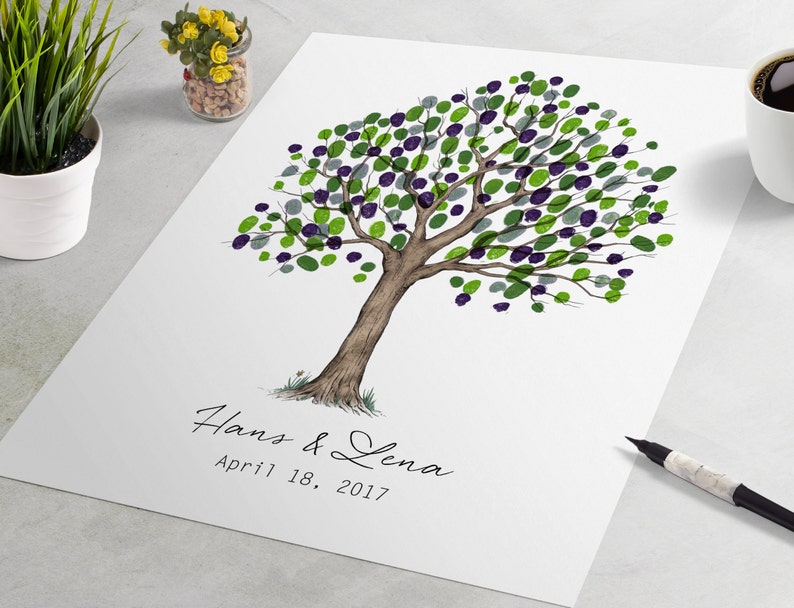
I want to click on plant, so click(x=60, y=69).